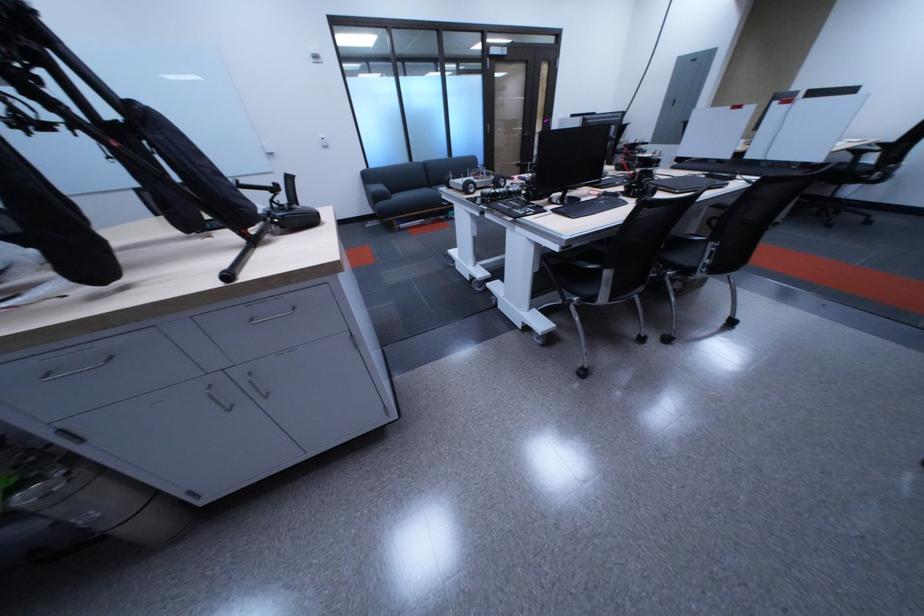
Find where to grip the gimbal handle. Please return your answer as a coordinate pair (x, y).

(245, 253)